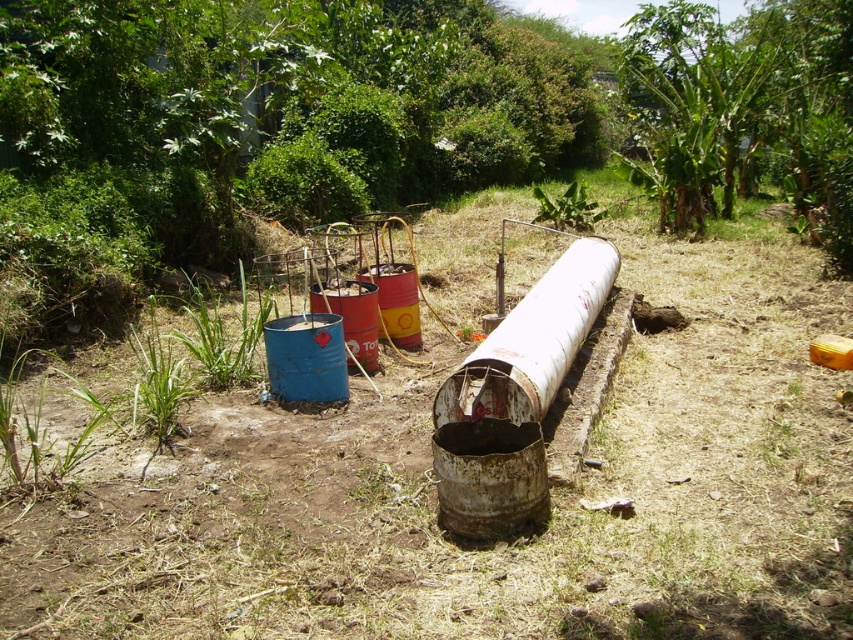
Question: Is green grass at center to the right of green grass at lower left from the viewer's perspective?

Choices:
 (A) yes
 (B) no

Answer: (B)

Question: Where is green grass at center located in relation to green grass at lower left in the image?

Choices:
 (A) above
 (B) below

Answer: (B)

Question: Among these points, which one is nearest to the camera?

Choices:
 (A) (244, 374)
 (B) (392, 632)

Answer: (B)

Question: Which object is farther from the camera taking this photo?

Choices:
 (A) green grass at lower left
 (B) green grass at center

Answer: (B)

Question: Does green grass at center have a greater width compared to green grass at lower left?

Choices:
 (A) yes
 (B) no

Answer: (B)